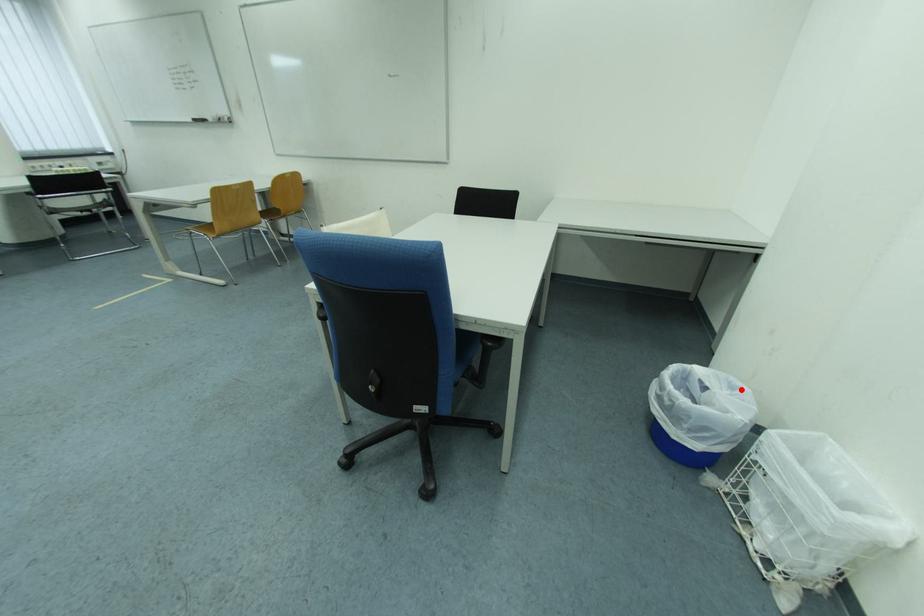
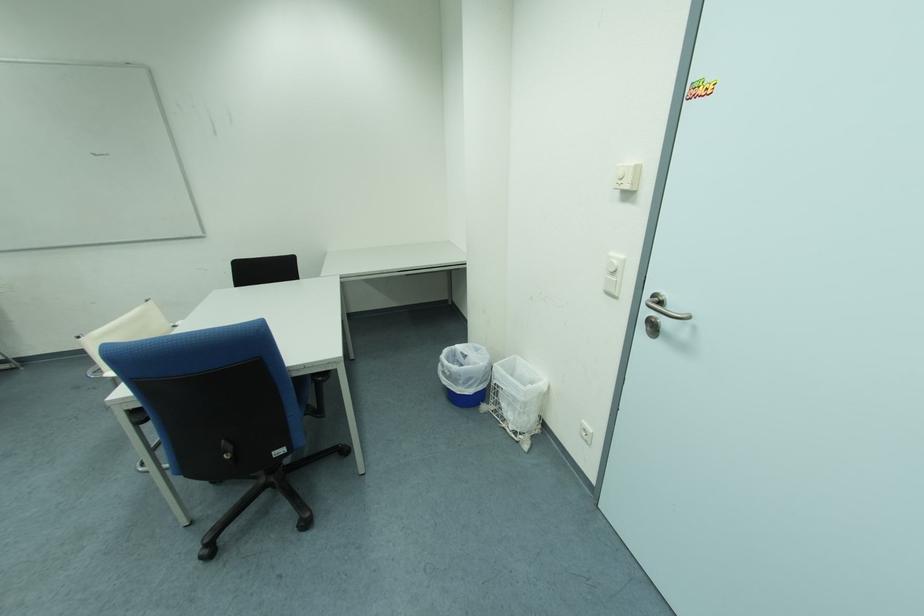
Locate, in the second image, the point that corresponds to the highlighted location in the first image.

(485, 352)